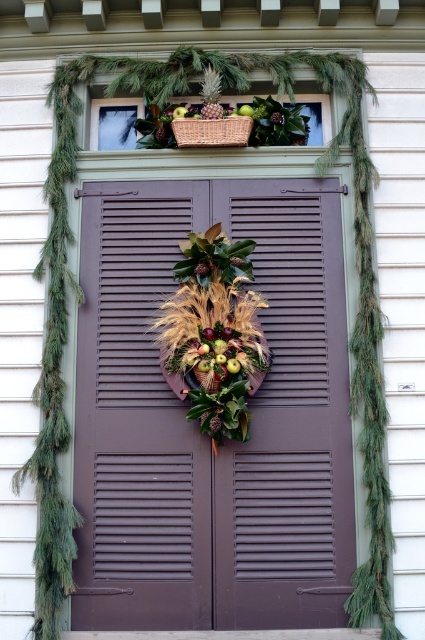
Question: Which of the following is the closest to the observer?

Choices:
 (A) (206, 116)
 (B) (278, 112)
 (C) (207, 387)
 (D) (195, 132)

Answer: (C)

Question: Is brown matte door at center bigger than brushed metal pineapple at upper center?

Choices:
 (A) no
 (B) yes

Answer: (B)

Question: Considering the relative positions of woven brown basket at upper center and wooden woven basket at center in the image provided, where is woven brown basket at upper center located with respect to wooden woven basket at center?

Choices:
 (A) below
 (B) above

Answer: (B)

Question: Which point appears farthest from the camera in this image?

Choices:
 (A) (323, 348)
 (B) (218, 115)
 (C) (240, 120)

Answer: (B)

Question: Which point is farther to the camera?

Choices:
 (A) brown matte door at center
 (B) brushed metal pineapple at upper center

Answer: (B)

Question: Is the position of woven brown basket at upper center less distant than that of brushed metal pineapple at upper center?

Choices:
 (A) yes
 (B) no

Answer: (A)